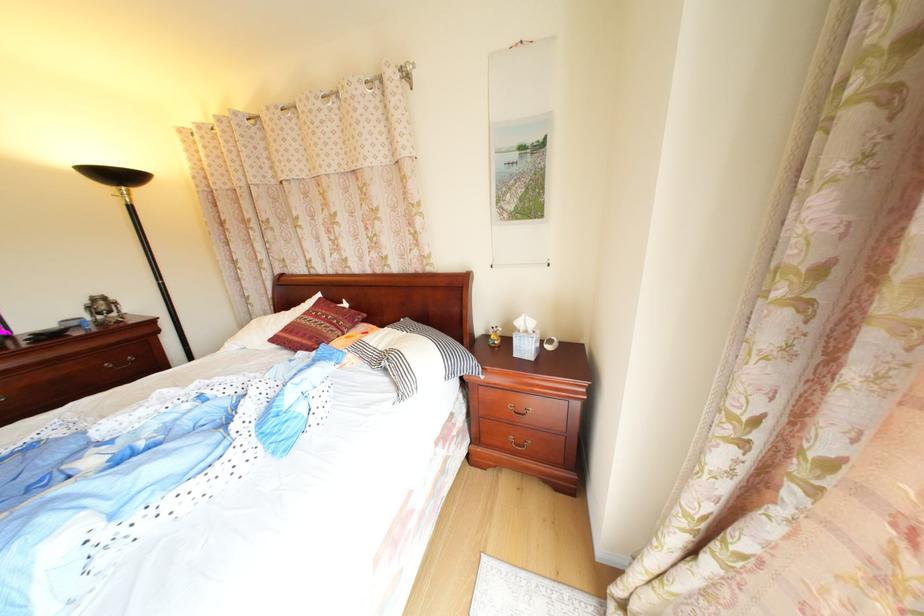
What are the coordinates of `small figurine` in the screenshot? It's located at (494, 336).